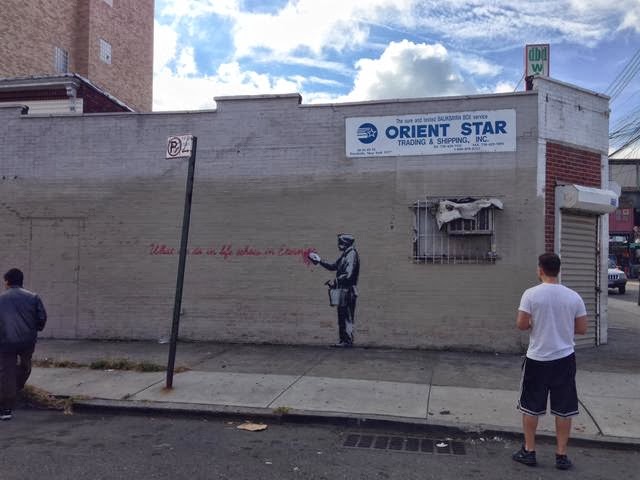
Locate an element on the screen. The height and width of the screenshot is (480, 640). painting of man is located at coordinates (348, 270).